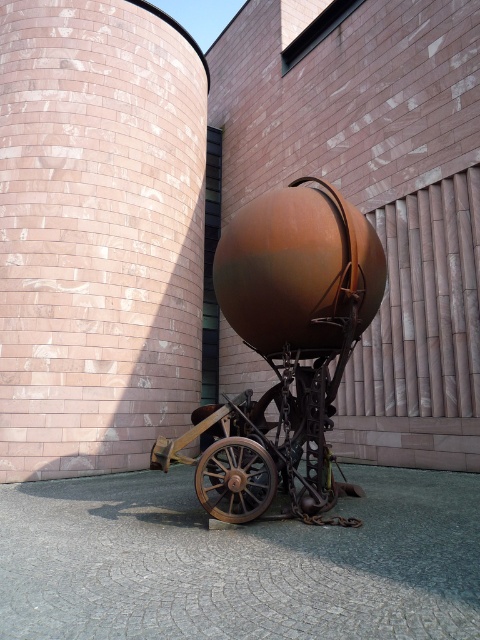
Between point (226, 540) and point (237, 509), which one is positioned in front?

Point (226, 540)

Looking at this image, is rusty metal sphere at center behind rusty metal wagon at center?

No.

Between point (88, 496) and point (226, 417), which one is positioned behind?

The point (88, 496) is behind.

The image size is (480, 640). Identify the location of rusty metal sphere at center. (238, 563).

Which is more to the left, rustic brick pillar at center or rusty metal sphere at center?

rustic brick pillar at center

Find the location of a particular element. This screenshot has height=640, width=480. rustic brick pillar at center is located at coordinates (97, 234).

Image resolution: width=480 pixels, height=640 pixels. Identify the location of rustic brick pillar at center. (97, 234).

Is point (264, 593) positioned behind point (247, 504)?

No, (264, 593) is in front of (247, 504).

Between point (158, 552) and point (229, 512), which one is positioned in front?

Point (158, 552)

This screenshot has width=480, height=640. I want to click on rusty metal sphere at center, so click(x=238, y=563).